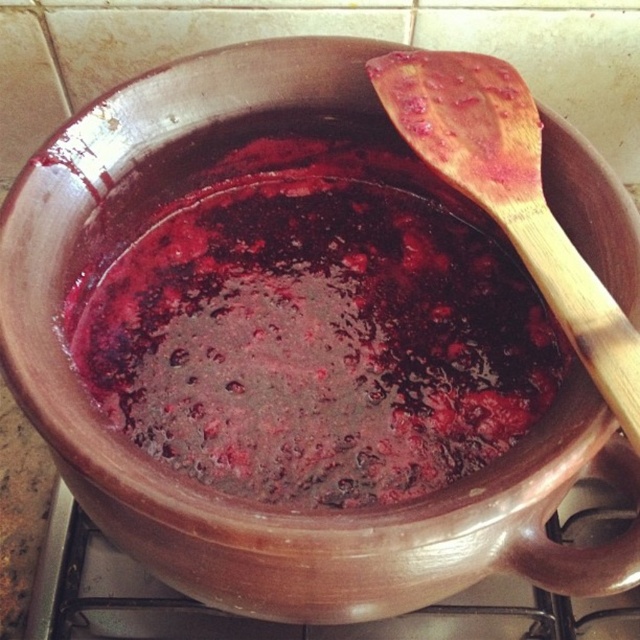
Does shiny dark red jam at center have a greater width compared to wooden spoon at upper right?

Yes.

This screenshot has height=640, width=640. What do you see at coordinates (317, 330) in the screenshot?
I see `shiny dark red jam at center` at bounding box center [317, 330].

The image size is (640, 640). What are the coordinates of `shiny dark red jam at center` in the screenshot? It's located at (317, 330).